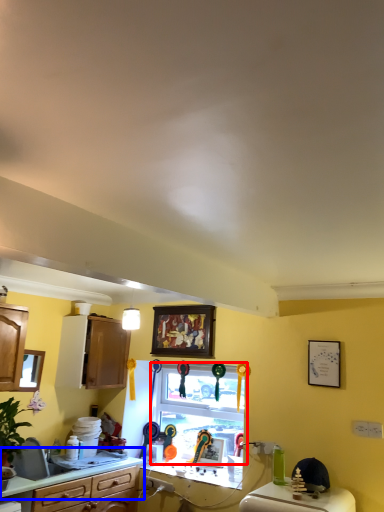
Question: Among these objects, which one is farthest to the camera, window (highlighted by a red box) or countertop (highlighted by a blue box)?

Choices:
 (A) window
 (B) countertop

Answer: (A)